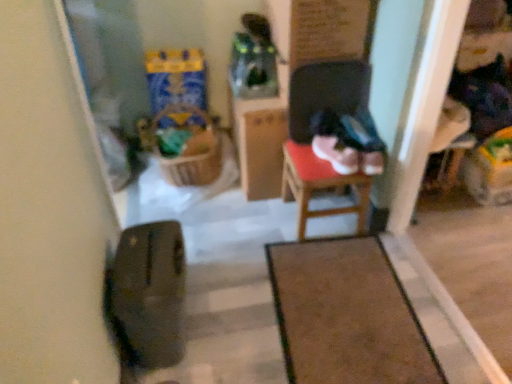
Where is `free spot above brown carpet at center (from a real-world perspective)`? The height and width of the screenshot is (384, 512). free spot above brown carpet at center (from a real-world perspective) is located at coordinates (347, 305).